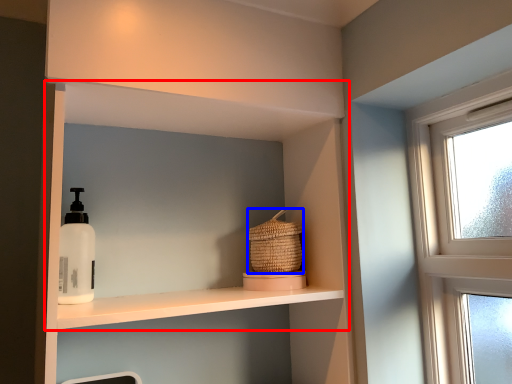
Question: Which object appears farthest to the camera in this image, shelf (highlighted by a red box) or basket (highlighted by a blue box)?

Choices:
 (A) shelf
 (B) basket

Answer: (B)